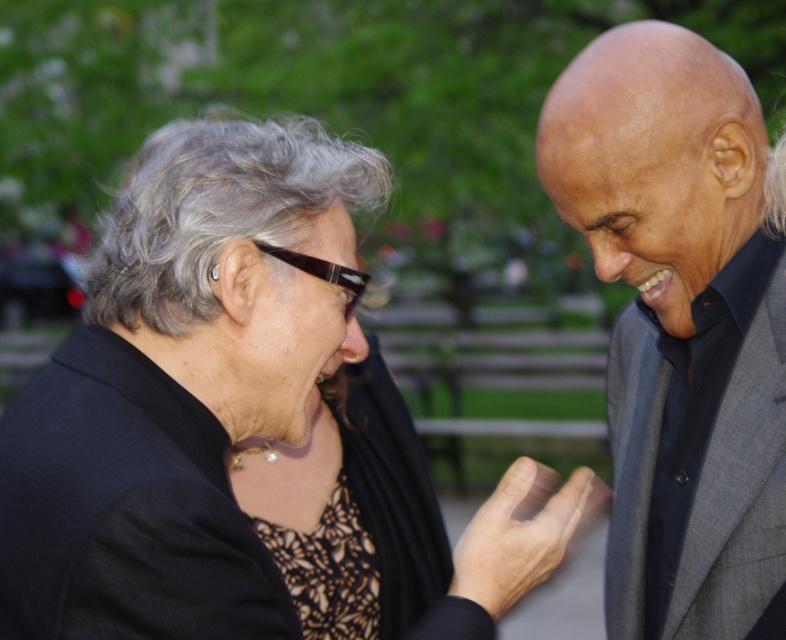
Question: Can you confirm if gray suit at right is thinner than gray wool business suit at right?

Choices:
 (A) yes
 (B) no

Answer: (B)

Question: Which point is closer to the camera?

Choices:
 (A) gray wool business suit at right
 (B) gray suit at right

Answer: (B)

Question: Which of the following is the closest to the observer?

Choices:
 (A) gray suit at right
 (B) gray wool business suit at right

Answer: (A)

Question: Does gray suit at right appear on the right side of gray wool business suit at right?

Choices:
 (A) no
 (B) yes

Answer: (A)

Question: Which object appears farthest from the camera in this image?

Choices:
 (A) gray suit at right
 (B) gray wool business suit at right

Answer: (B)

Question: Is gray suit at right above gray wool business suit at right?

Choices:
 (A) yes
 (B) no

Answer: (B)